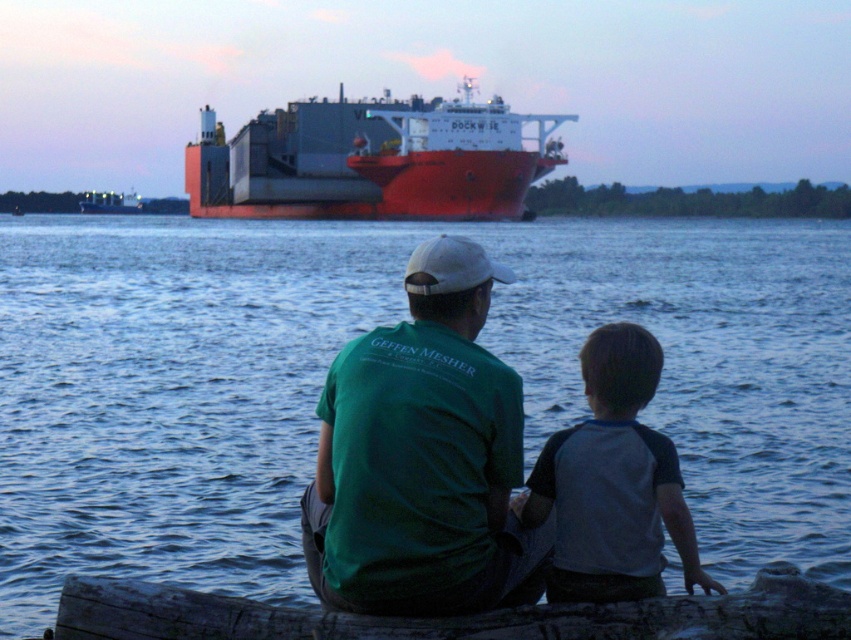
Is green cotton shirt at center smaller than red matte cargo ship at center?

Correct, green cotton shirt at center occupies less space than red matte cargo ship at center.

Locate an element on the screen. The height and width of the screenshot is (640, 851). green cotton shirt at center is located at coordinates (423, 458).

Which is behind, point (413, 573) or point (270, 168)?

Positioned behind is point (270, 168).

You are a GUI agent. You are given a task and a screenshot of the screen. Output one action in this format:
    pyautogui.click(x=<x>, y=<y>)
    Task: Click on the green cotton shirt at center
    This screenshot has height=640, width=851.
    Given the screenshot: What is the action you would take?
    pyautogui.click(x=423, y=458)

This screenshot has height=640, width=851. Describe the element at coordinates (423, 458) in the screenshot. I see `green cotton shirt at center` at that location.

Can you confirm if green cotton shirt at center is positioned to the left of metallic gray container ship at upper center?

In fact, green cotton shirt at center is to the right of metallic gray container ship at upper center.

Between point (500, 433) and point (117, 211), which one is positioned in front?

Point (500, 433) is in front.

This screenshot has width=851, height=640. Find the location of `green cotton shirt at center`. green cotton shirt at center is located at coordinates (423, 458).

I want to click on green cotton shirt at center, so click(423, 458).

Which is below, green cotton shirt at center or gray raglan shirt at lower right?

Positioned lower is gray raglan shirt at lower right.

Is point (453, 310) closer to camera compared to point (601, 572)?

That is False.

Image resolution: width=851 pixels, height=640 pixels. Identify the location of green cotton shirt at center. (423, 458).